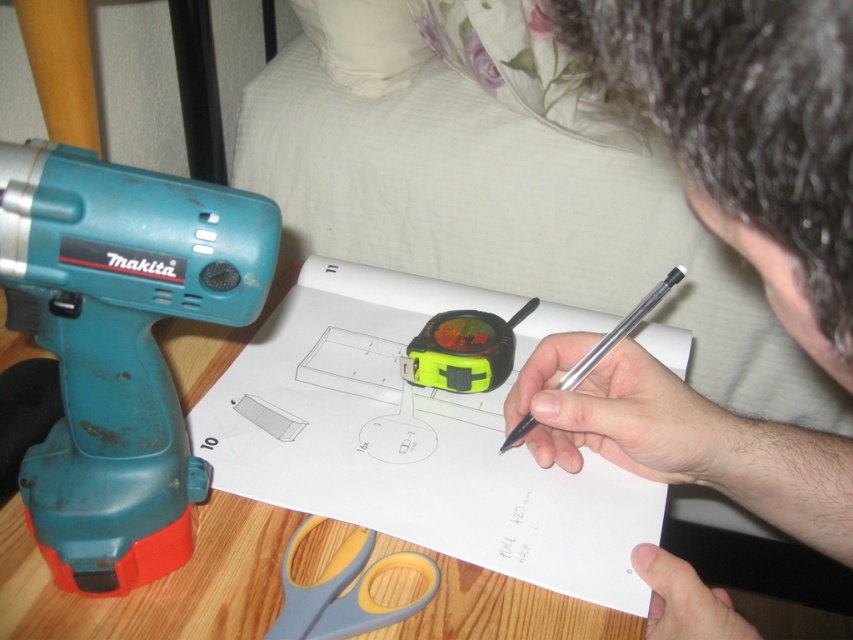
Question: Can you confirm if wooden table at left is positioned above yellow/grey plastic scissors at lower left?

Choices:
 (A) yes
 (B) no

Answer: (A)

Question: Can you confirm if wooden table at left is wider than yellow/grey plastic scissors at lower left?

Choices:
 (A) yes
 (B) no

Answer: (A)

Question: Can you confirm if teal plastic drill at left is positioned above yellow/grey plastic scissors at lower left?

Choices:
 (A) yes
 (B) no

Answer: (A)

Question: Which object is farther from the camera taking this photo?

Choices:
 (A) teal plastic drill at left
 (B) silver metallic pen at center
 (C) wooden table at left
 (D) dark brown hair at upper right

Answer: (B)

Question: Which point is farther from the camera taking this photo?

Choices:
 (A) (366, 604)
 (B) (1, 241)

Answer: (A)

Question: Among these points, which one is nearest to the camera?

Choices:
 (A) (416, 605)
 (B) (47, 579)
 (C) (459, 369)

Answer: (A)